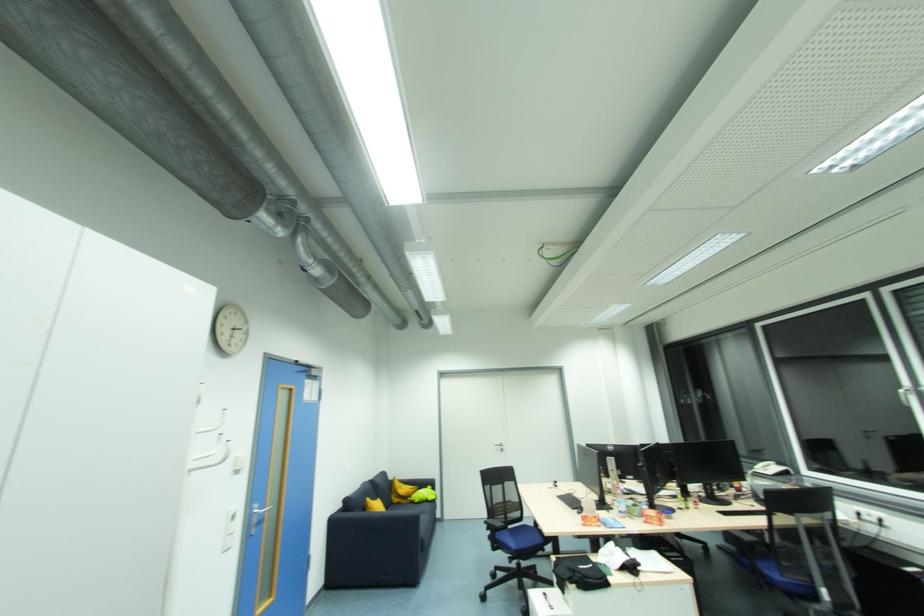
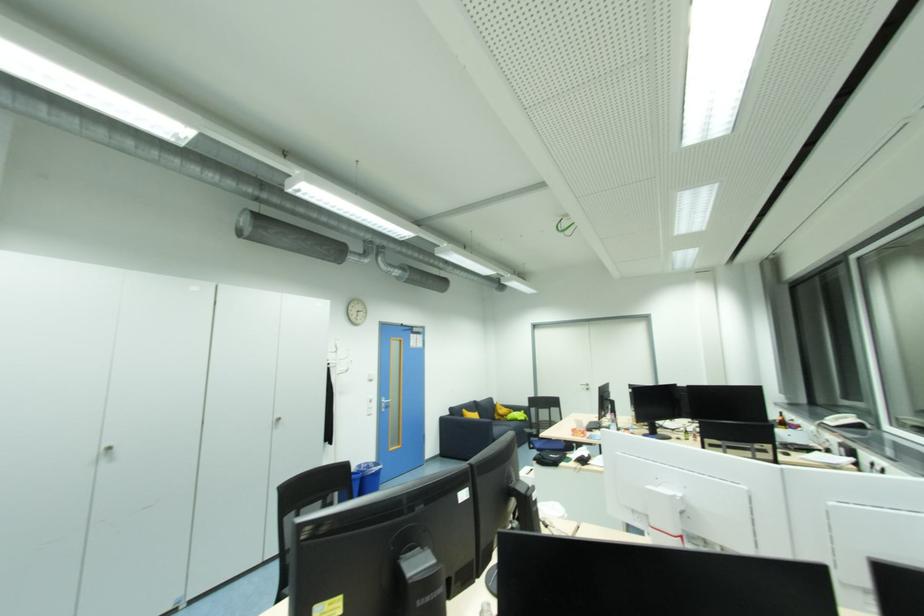
Question: I am providing you with two images of the same scene from different viewpoints. After the viewpoint changes to image2, which objects are now occluded?

Choices:
 (A) black chair armrest
 (B) black control button
 (C) black chair back top rail
 (D) dark sofa armrest

Answer: (A)